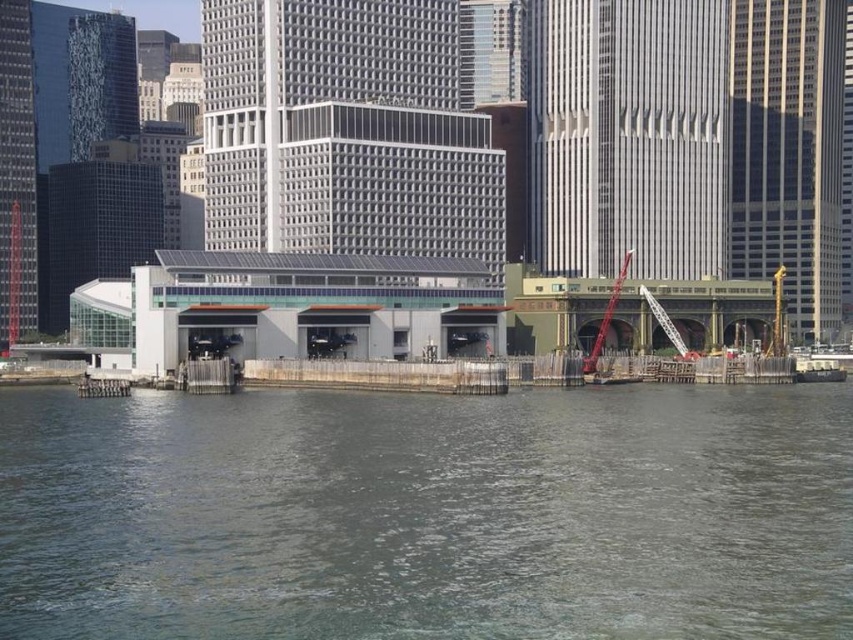
Question: In this image, where is gray concrete river at lower center located relative to metallic gray crane at center right?

Choices:
 (A) left
 (B) right

Answer: (A)

Question: Is gray concrete river at lower center thinner than metallic gray crane at center right?

Choices:
 (A) yes
 (B) no

Answer: (B)

Question: Which of the following is the farthest from the observer?

Choices:
 (A) gray concrete river at lower center
 (B) red metallic crane at center right
 (C) metallic gray crane at center right

Answer: (C)

Question: Which point is closer to the camera taking this photo?

Choices:
 (A) (544, 609)
 (B) (611, 300)
 (C) (663, 328)

Answer: (A)

Question: Can you confirm if gray concrete river at lower center is positioned above metallic gray crane at center right?

Choices:
 (A) yes
 (B) no

Answer: (B)

Question: Which point appears closest to the camera in this image?

Choices:
 (A) (622, 276)
 (B) (682, 344)
 (C) (194, 634)

Answer: (C)